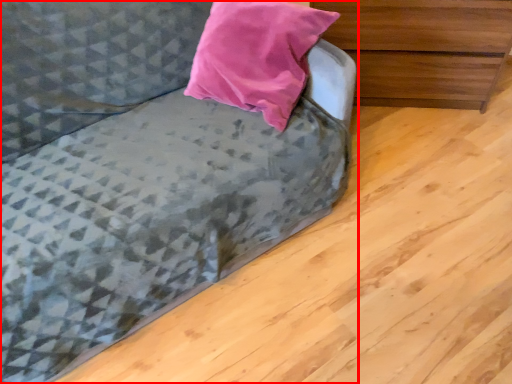
Question: From the image's perspective, what is the correct spatial positioning of studio couch (annotated by the red box) in reference to chest of drawers?

Choices:
 (A) below
 (B) above

Answer: (A)